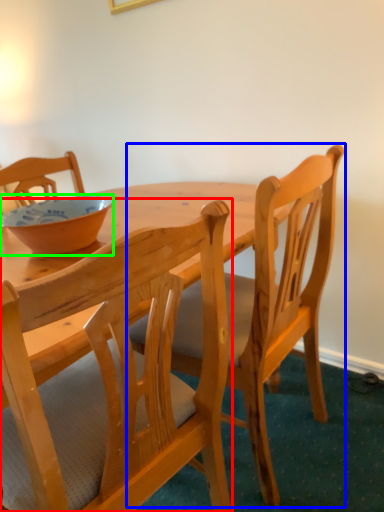
Question: Which object is the closest to the chair (highlighted by a red box)? Choose among these: chair (highlighted by a blue box) or bowl (highlighted by a green box).

Choices:
 (A) chair
 (B) bowl

Answer: (A)